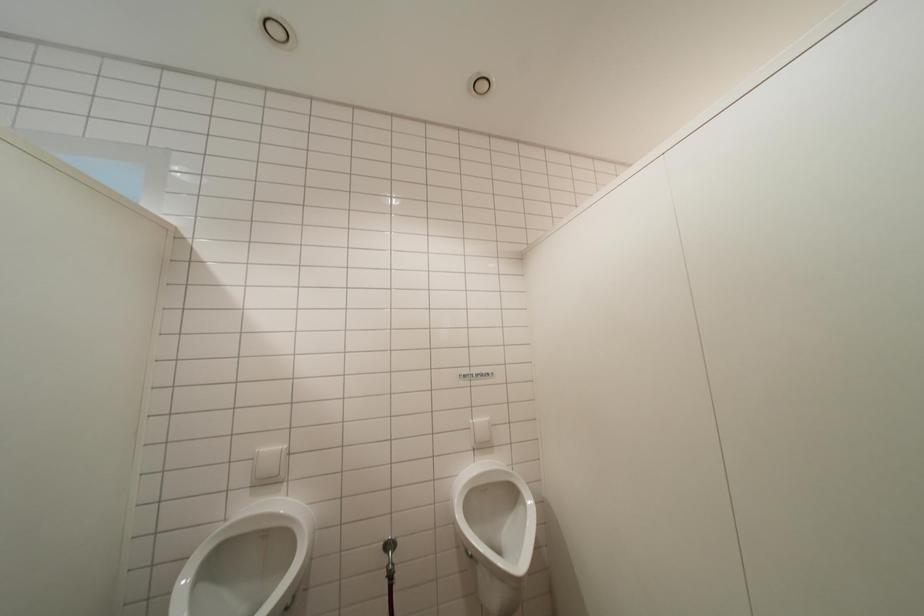
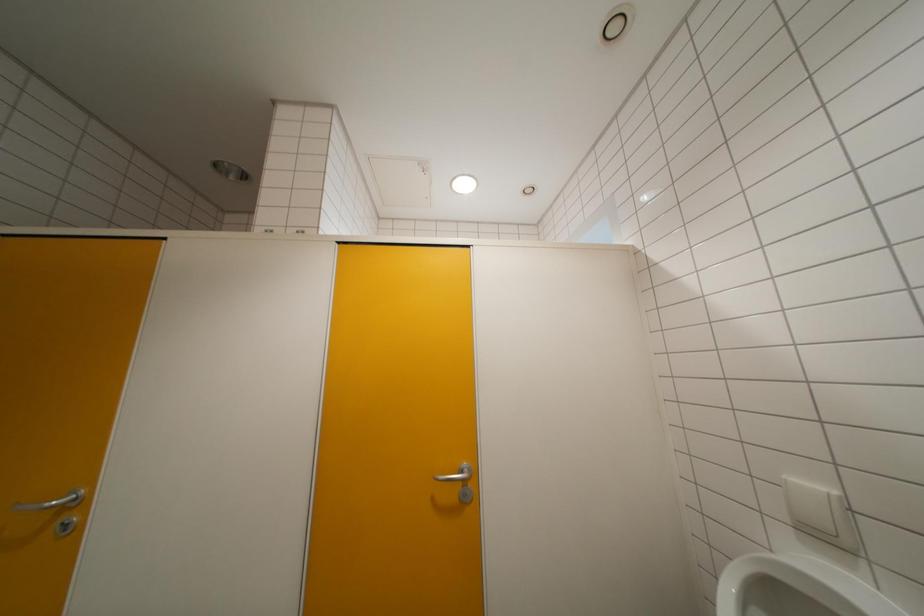
Question: The first image is from the beginning of the video and the second image is from the end. How did the camera likely rotate when shooting the video?

Choices:
 (A) Left
 (B) Right
 (C) Up
 (D) Down

Answer: (A)